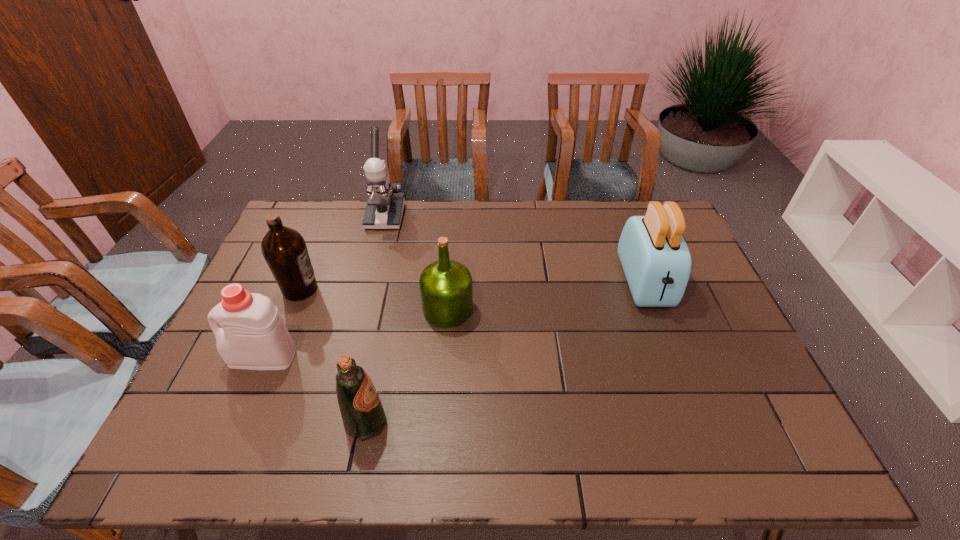
Where is `vacant region located on the back of the rightmost olive oil`? This screenshot has width=960, height=540. vacant region located on the back of the rightmost olive oil is located at coordinates point(453,229).

I want to click on vacant area situated on the front-facing side of the second olive oil from left to right, so click(x=418, y=422).

Locate an element on the screen. Image resolution: width=960 pixels, height=540 pixels. object located at the far edge is located at coordinates (384, 209).

Where is `object at the near edge`? This screenshot has width=960, height=540. object at the near edge is located at coordinates (361, 408).

What are the coordinates of `olive oil present at the left edge` in the screenshot? It's located at (284, 249).

At what (x,y) coordinates should I click in order to perform the action: click on detergent present at the left edge. Please return your answer as a coordinate pair (x, y). Looking at the image, I should click on (253, 336).

Where is `object that is at the right edge`? The height and width of the screenshot is (540, 960). object that is at the right edge is located at coordinates (655, 258).

In the image, there is a desktop. At what (x,y) coordinates should I click in order to perform the action: click on free space at the far edge. Please return your answer as a coordinate pair (x, y). Image resolution: width=960 pixels, height=540 pixels. Looking at the image, I should click on (344, 225).

What are the coordinates of `free space at the near edge of the desktop` in the screenshot? It's located at (590, 437).

This screenshot has height=540, width=960. In the image, there is a desktop. Find the location of `vacant space at the right edge`. vacant space at the right edge is located at coordinates (722, 428).